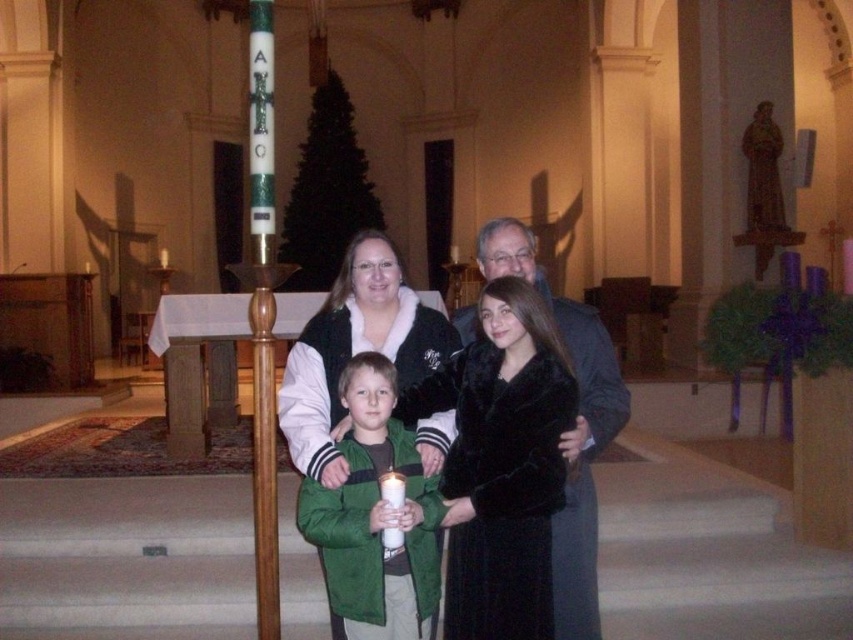
Question: Considering the relative positions of black fur coat at center and velvet gray coat at center in the image provided, where is black fur coat at center located with respect to velvet gray coat at center?

Choices:
 (A) below
 (B) above

Answer: (B)

Question: Among these points, which one is farthest from the camera?

Choices:
 (A) (357, 529)
 (B) (492, 528)

Answer: (B)

Question: Does black fur coat at center come in front of green fuzzy jacket at center?

Choices:
 (A) no
 (B) yes

Answer: (A)

Question: Does black fur coat at center have a larger size compared to green fuzzy jacket at center?

Choices:
 (A) yes
 (B) no

Answer: (B)

Question: Which of the following is the closest to the observer?

Choices:
 (A) pos(585,424)
 (B) pos(520,468)
 (C) pos(405,536)

Answer: (C)

Question: Based on their relative distances, which object is farther from the black fur coat at center?

Choices:
 (A) green fuzzy jacket at center
 (B) velvet gray coat at center

Answer: (B)